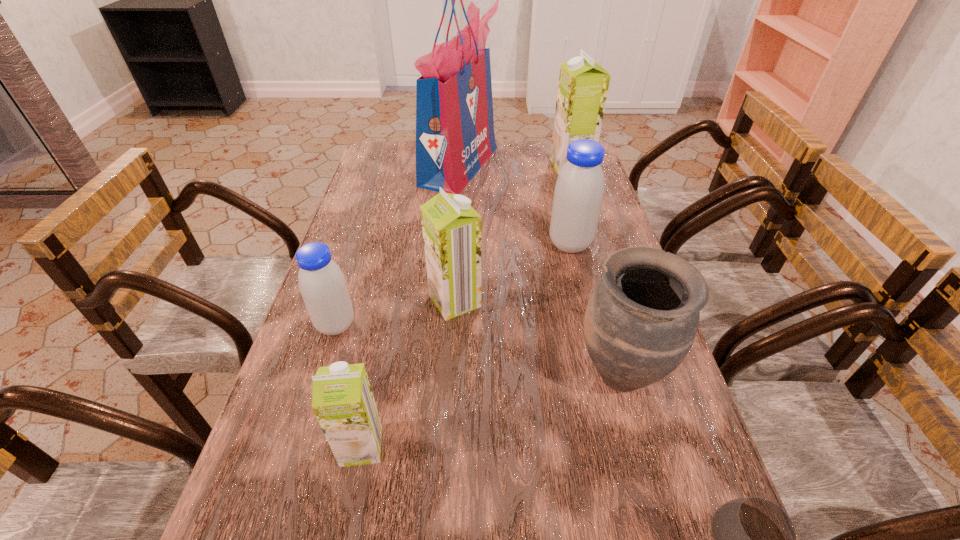
Identify which object is the fourth closest to the shortest object. Please provide its 2D coordinates. Your answer should be formatted as a tuple, i.e. [(x, y)], where the tuple contains the x and y coordinates of a point satisfying the conditions above.

[(579, 190)]

Locate an element on the screen. soya milk that is the second closest to the second green soya milk from right to left is located at coordinates (579, 190).

Locate which soya milk ranks fourth in proximity to the third farthest object. Please provide its 2D coordinates. Your answer should be formatted as a tuple, i.e. [(x, y)], where the tuple contains the x and y coordinates of a point satisfying the conditions above.

[(342, 400)]

Identify which green soya milk is the third closest to the right blue soya milk. Please provide its 2D coordinates. Your answer should be formatted as a tuple, i.e. [(x, y)], where the tuple contains the x and y coordinates of a point satisfying the conditions above.

[(342, 400)]

Where is `the second closest green soya milk relative to the nearest object`? This screenshot has width=960, height=540. the second closest green soya milk relative to the nearest object is located at coordinates (451, 228).

Find the location of a particular element. The height and width of the screenshot is (540, 960). vacant space that satisfies the following two spatial constraints: 1. on the front side of the nearer blue soya milk; 2. on the left side of the nearest green soya milk is located at coordinates (298, 446).

Identify the location of vacant region that satisfies the following two spatial constraints: 1. on the front-facing side of the second farthest soya milk; 2. on the right side of the red grocery bag. (454, 244).

Locate an element on the screen. vacant space that satisfies the following two spatial constraints: 1. on the back side of the farthest green soya milk; 2. on the left side of the nearest green soya milk is located at coordinates (419, 166).